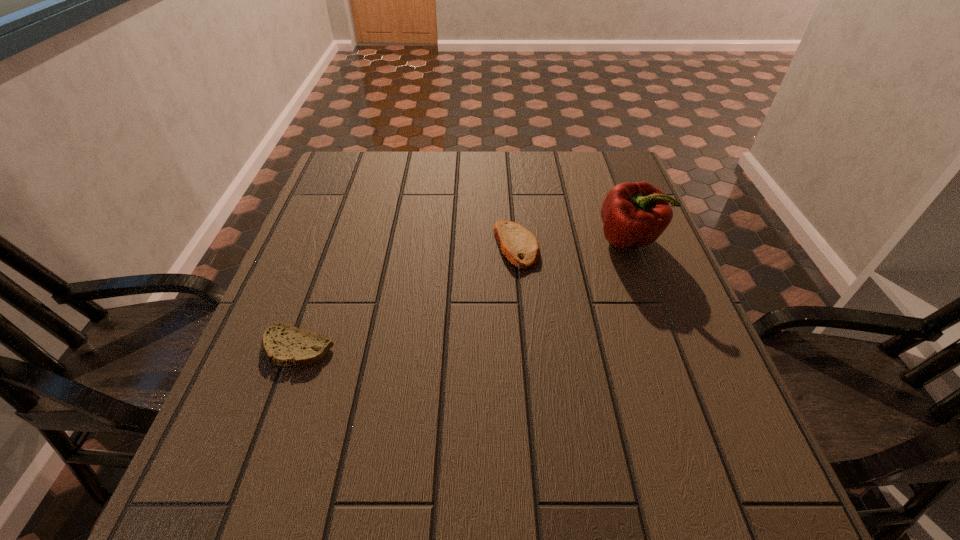
Where is `object that is at the right edge`? object that is at the right edge is located at coordinates (637, 213).

Where is `free location at the far edge`? This screenshot has height=540, width=960. free location at the far edge is located at coordinates (389, 156).

Locate an element on the screen. This screenshot has height=540, width=960. free space at the near edge is located at coordinates (477, 515).

You are a GUI agent. You are given a task and a screenshot of the screen. Output one action in this format:
    pyautogui.click(x=<x>, y=<y>)
    Task: Click on the vacant space at the left edge
    
    Given the screenshot: What is the action you would take?
    pyautogui.click(x=256, y=369)

Locate an element on the screen. This screenshot has height=540, width=960. free space at the right edge of the desktop is located at coordinates (615, 298).

Identify the location of free point between the bell pepper and the shortest object. The height and width of the screenshot is (540, 960). (464, 294).

You are a GUI agent. You are given a task and a screenshot of the screen. Output one action in this format:
    pyautogui.click(x=<x>, y=<y>)
    Task: Click on the unoccupied position between the second tallest object and the nearer pita bread
    The height and width of the screenshot is (540, 960).
    Given the screenshot: What is the action you would take?
    pyautogui.click(x=407, y=296)

Find the location of a particular element. The image size is (960, 540). free point between the shorter pita bread and the right pita bread is located at coordinates (407, 296).

Find the location of a particular element. The width and height of the screenshot is (960, 540). unoccupied area between the nearest object and the right pita bread is located at coordinates (407, 296).

Find the location of a particular element. The height and width of the screenshot is (540, 960). free space between the taller pita bread and the tallest object is located at coordinates (572, 242).